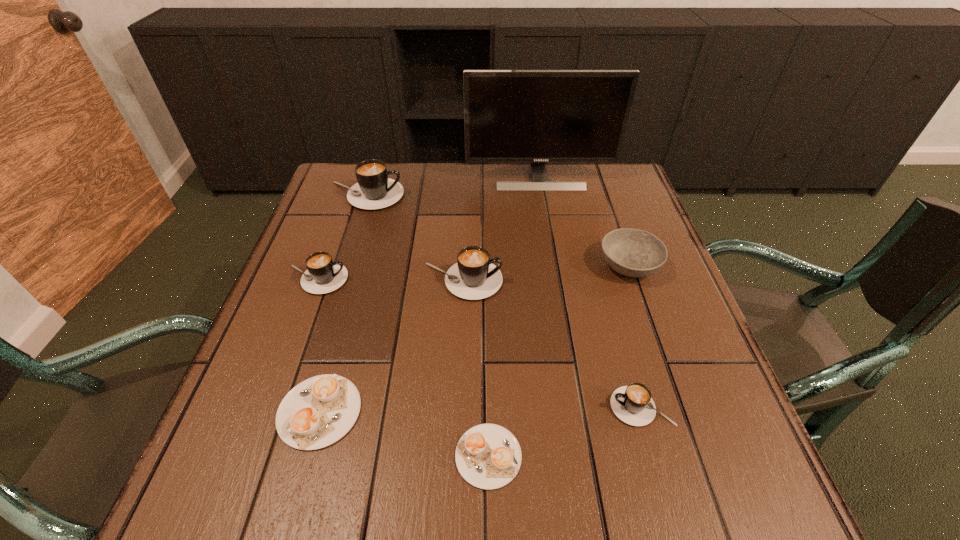
Where is `the fourth closest black cappuccino relative to the bowl`? The image size is (960, 540). the fourth closest black cappuccino relative to the bowl is located at coordinates (322, 276).

This screenshot has height=540, width=960. In order to click on vacant space that satisfies the following two spatial constraints: 1. on the screen side of the tallest object; 2. with the handle on the side of the second smallest black cappuccino in this screenshot , I will do `click(557, 279)`.

Identify the location of vacant point that satisfies the following two spatial constraints: 1. with the handle on the side of the right white cappuccino; 2. on the left side of the seventh shortest object. (282, 456).

This screenshot has height=540, width=960. In order to click on free space that satisfies the following two spatial constraints: 1. on the front side of the bowl; 2. with the handle on the side of the third biggest black cappuccino in this screenshot , I will do `click(634, 279)`.

The height and width of the screenshot is (540, 960). Find the location of `vacant point that satisfies the following two spatial constraints: 1. on the screen side of the monitor; 2. with the handle on the side of the third tallest object`. vacant point that satisfies the following two spatial constraints: 1. on the screen side of the monitor; 2. with the handle on the side of the third tallest object is located at coordinates (557, 281).

Locate an element on the screen. vacant position in the image that satisfies the following two spatial constraints: 1. with the handle on the side of the shortest object; 2. on the right side of the third tallest object is located at coordinates (456, 456).

I want to click on free spot that satisfies the following two spatial constraints: 1. on the back side of the second shortest cappuccino; 2. with the handle on the side of the second smallest black cappuccino, so coord(356,279).

Locate an element on the screen. This screenshot has width=960, height=540. vacant region that satisfies the following two spatial constraints: 1. with the handle on the side of the shortest cappuccino; 2. on the left side of the fourth shortest cappuccino is located at coordinates (252, 456).